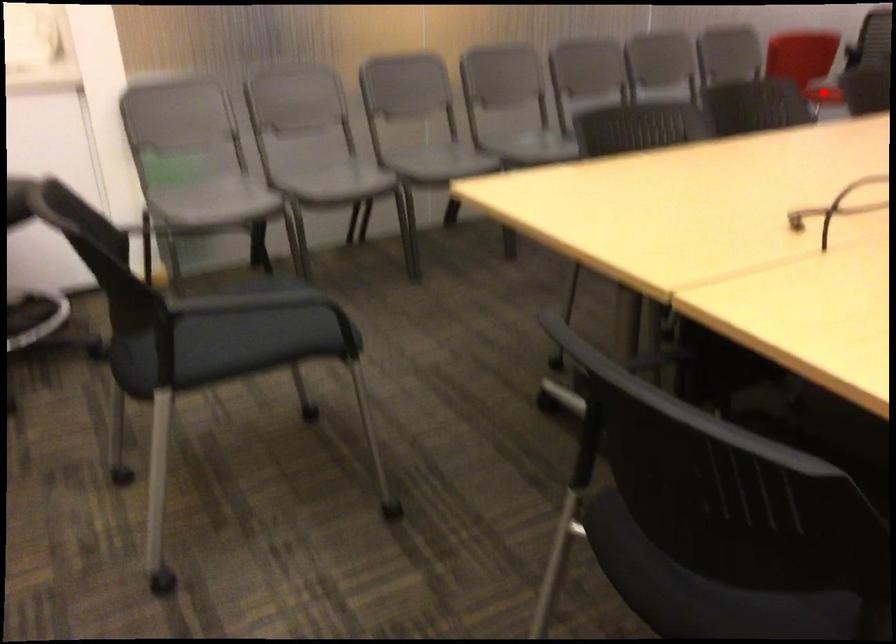
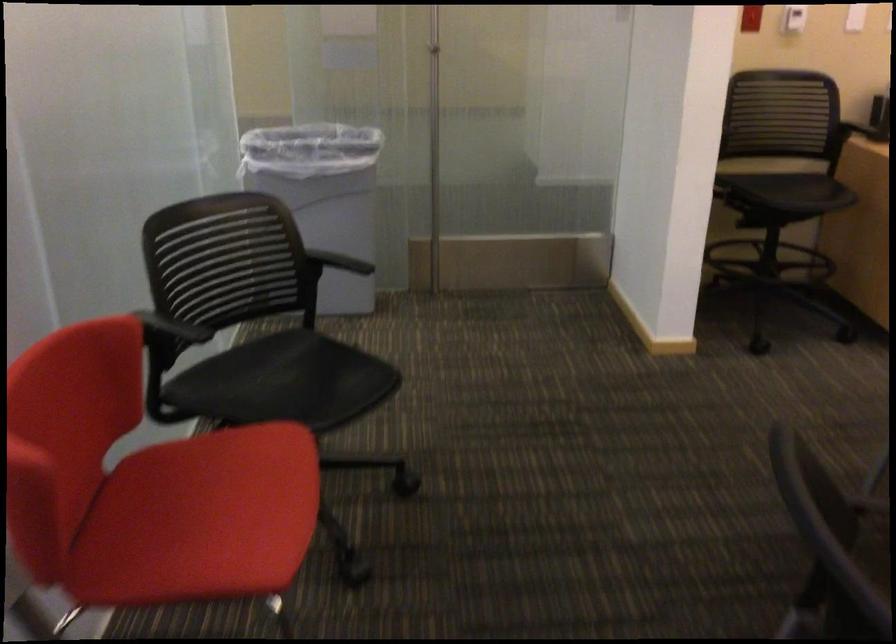
Question: I am providing you with two images of the same scene from different viewpoints. Image1 has a red point marked. In image2, the corresponding 3D location appears at what relative position? Reply with the corresponding letter.

Choices:
 (A) Closer
 (B) Farther

Answer: (A)